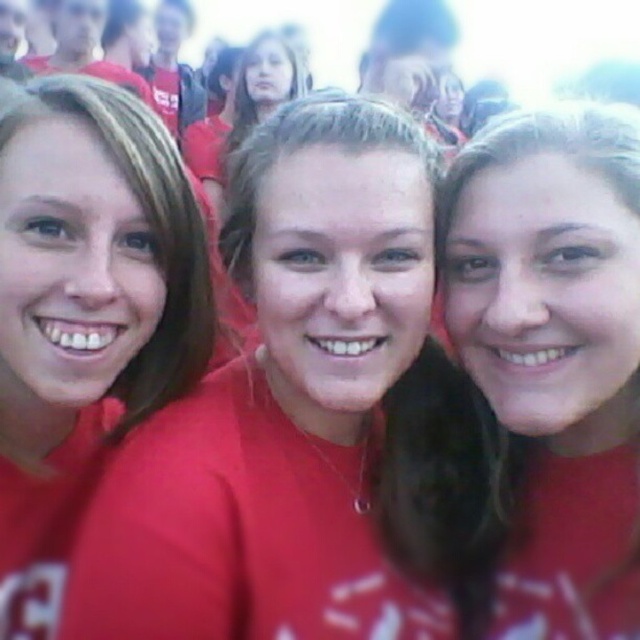
Is the position of matte red shirt at center less distant than that of matte red shirt at left?

That is True.

Does matte red shirt at center appear under matte red shirt at left?

Correct, matte red shirt at center is located below matte red shirt at left.

Is point (630, 390) farther from camera compared to point (128, 316)?

Yes.

Image resolution: width=640 pixels, height=640 pixels. I want to click on matte red shirt at center, so click(x=554, y=353).